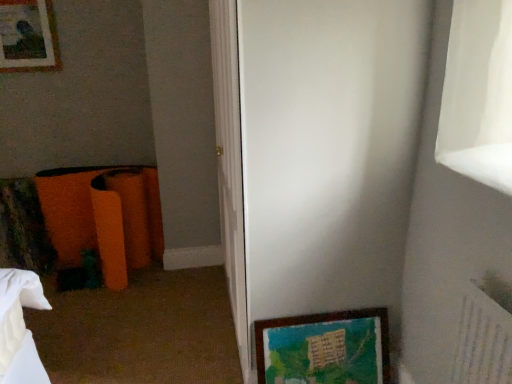
How much space does wooden framed artwork at lower right, which appears as the second picture frame when viewed from the left, occupy vertically?

The height of wooden framed artwork at lower right, which appears as the second picture frame when viewed from the left, is 36.14 centimeters.

Describe the element at coordinates (28, 36) in the screenshot. Image resolution: width=512 pixels, height=384 pixels. I see `matte wooden picture frame at upper left, the first picture frame viewed from the back` at that location.

What do you see at coordinates (328, 151) in the screenshot?
I see `white glossy screen door at center` at bounding box center [328, 151].

Find the location of a particular element. This screenshot has width=512, height=384. wooden framed artwork at lower right, which appears as the 2th picture frame when viewed from the top is located at coordinates (325, 348).

Which picture frame is the 1st one when counting from the back of the white glossy screen door at center? Please provide its 2D coordinates.

[(325, 348)]

Is white glossy screen door at center at the back of wooden framed artwork at lower right, the 1th picture frame in the right-to-left sequence?

Yes, wooden framed artwork at lower right, the 1th picture frame in the right-to-left sequence, is facing away from white glossy screen door at center.

From the image's perspective, is wooden framed artwork at lower right, positioned as the first picture frame in front-to-back order, located above or below white glossy screen door at center?

Answer: Based on their image positions, wooden framed artwork at lower right, positioned as the first picture frame in front-to-back order, is located beneath white glossy screen door at center.

Measure the distance from wooden framed artwork at lower right, which appears as the 2th picture frame when viewed from the top, to white glossy screen door at center.

16.13 inches.

Is wooden framed artwork at lower right, which appears as the 2th picture frame when viewed from the top, a part of matte wooden picture frame at upper left, acting as the 2th picture frame starting from the bottom?

That's incorrect, wooden framed artwork at lower right, which appears as the 2th picture frame when viewed from the top, is not inside matte wooden picture frame at upper left, acting as the 2th picture frame starting from the bottom.

From a real-world perspective, is matte wooden picture frame at upper left, which appears as the 1th picture frame when viewed from the top, beneath wooden framed artwork at lower right, which appears as the first picture frame when ordered from the bottom?

Incorrect, from a real-world perspective, matte wooden picture frame at upper left, which appears as the 1th picture frame when viewed from the top, is higher than wooden framed artwork at lower right, which appears as the first picture frame when ordered from the bottom.

Where is `picture frame that appears on the right of matte wooden picture frame at upper left, the second picture frame when ordered from right to left`? The image size is (512, 384). picture frame that appears on the right of matte wooden picture frame at upper left, the second picture frame when ordered from right to left is located at coordinates (325, 348).

Does white glossy screen door at center have a greater height compared to wooden framed artwork at lower right, the 2th picture frame positioned from the back?

Yes, white glossy screen door at center is taller than wooden framed artwork at lower right, the 2th picture frame positioned from the back.

From the picture: Considering the sizes of white glossy screen door at center and wooden framed artwork at lower right, positioned as the first picture frame in front-to-back order, in the image, is white glossy screen door at center wider or thinner than wooden framed artwork at lower right, positioned as the first picture frame in front-to-back order,?

In the image, white glossy screen door at center appears to be wider than wooden framed artwork at lower right, positioned as the first picture frame in front-to-back order.

Considering the positions of objects white glossy screen door at center and wooden framed artwork at lower right, positioned as the first picture frame in front-to-back order, in the image provided, who is in front, white glossy screen door at center or wooden framed artwork at lower right, positioned as the first picture frame in front-to-back order,?

white glossy screen door at center is more forward.

Is white glossy screen door at center to the right of matte wooden picture frame at upper left, the first picture frame viewed from the back, from the viewer's perspective?

Yes.

From a real-world perspective, between white glossy screen door at center and matte wooden picture frame at upper left, acting as the 2th picture frame starting from the bottom, who is vertically higher?

From a 3D spatial view, matte wooden picture frame at upper left, acting as the 2th picture frame starting from the bottom, is above.

Can you tell me how much white glossy screen door at center and matte wooden picture frame at upper left, which appears as the 1th picture frame when viewed from the top, differ in facing direction?

white glossy screen door at center and matte wooden picture frame at upper left, which appears as the 1th picture frame when viewed from the top, are facing 90.1 degrees away from each other.

In terms of size, does white glossy screen door at center appear bigger or smaller than matte wooden picture frame at upper left, which ranks as the first picture frame in left-to-right order?

Considering their sizes, white glossy screen door at center takes up more space than matte wooden picture frame at upper left, which ranks as the first picture frame in left-to-right order.

Considering the sizes of wooden framed artwork at lower right, the 1th picture frame in the right-to-left sequence, and matte wooden picture frame at upper left, which appears as the 1th picture frame when viewed from the top, in the image, is wooden framed artwork at lower right, the 1th picture frame in the right-to-left sequence, taller or shorter than matte wooden picture frame at upper left, which appears as the 1th picture frame when viewed from the top,?

Considering their sizes, wooden framed artwork at lower right, the 1th picture frame in the right-to-left sequence, has less height than matte wooden picture frame at upper left, which appears as the 1th picture frame when viewed from the top.

Is wooden framed artwork at lower right, the 2th picture frame positioned from the back, wider than matte wooden picture frame at upper left, which appears as the 1th picture frame when viewed from the top?

Indeed, wooden framed artwork at lower right, the 2th picture frame positioned from the back, has a greater width compared to matte wooden picture frame at upper left, which appears as the 1th picture frame when viewed from the top.

Are wooden framed artwork at lower right, the 2th picture frame positioned from the back, and matte wooden picture frame at upper left, the second picture frame positioned from the front, far apart?

Yes, wooden framed artwork at lower right, the 2th picture frame positioned from the back, is far from matte wooden picture frame at upper left, the second picture frame positioned from the front.

Is point (386, 351) closer or farther from the camera than point (39, 8)?

Point (386, 351) is closer to the camera than point (39, 8).

Measure the distance between matte wooden picture frame at upper left, acting as the 2th picture frame starting from the bottom, and white glossy screen door at center.

They are 6.51 feet apart.

Is white glossy screen door at center at the back of matte wooden picture frame at upper left, the first picture frame viewed from the back?

No, matte wooden picture frame at upper left, the first picture frame viewed from the back, is not facing the opposite direction of white glossy screen door at center.

Considering their positions, is matte wooden picture frame at upper left, which appears as the 1th picture frame when viewed from the top, located in front of or behind white glossy screen door at center?

Clearly, matte wooden picture frame at upper left, which appears as the 1th picture frame when viewed from the top, is behind white glossy screen door at center.

From the image's perspective, relative to white glossy screen door at center, is matte wooden picture frame at upper left, the second picture frame positioned from the front, above or below?

matte wooden picture frame at upper left, the second picture frame positioned from the front, is above white glossy screen door at center.

Find the location of a particular element. The height and width of the screenshot is (384, 512). screen door that is in front of the wooden framed artwork at lower right, the 2th picture frame positioned from the back is located at coordinates (328, 151).

This screenshot has height=384, width=512. In order to click on picture frame positioned vertically above the wooden framed artwork at lower right, which appears as the first picture frame when ordered from the bottom (from a real-world perspective) in this screenshot , I will do `click(28, 36)`.

From the image, which object appears to be nearer to matte wooden picture frame at upper left, which ranks as the first picture frame in left-to-right order, white glossy screen door at center or wooden framed artwork at lower right, the 2th picture frame positioned from the back?

white glossy screen door at center is positioned closer to the anchor matte wooden picture frame at upper left, which ranks as the first picture frame in left-to-right order.

Based on the photo, when comparing their distances from matte wooden picture frame at upper left, the second picture frame positioned from the front, does wooden framed artwork at lower right, which appears as the 2th picture frame when viewed from the top, or white glossy screen door at center seem further?

wooden framed artwork at lower right, which appears as the 2th picture frame when viewed from the top, is further to matte wooden picture frame at upper left, the second picture frame positioned from the front.

Based on their spatial positions, is matte wooden picture frame at upper left, the first picture frame viewed from the back, or white glossy screen door at center closer to wooden framed artwork at lower right, which appears as the second picture frame when viewed from the left?

The object closer to wooden framed artwork at lower right, which appears as the second picture frame when viewed from the left, is white glossy screen door at center.

Considering their positions, is matte wooden picture frame at upper left, acting as the 2th picture frame starting from the bottom, positioned closer to white glossy screen door at center than wooden framed artwork at lower right, positioned as the first picture frame in front-to-back order?

wooden framed artwork at lower right, positioned as the first picture frame in front-to-back order.

Estimate the real-world distances between objects in this image. Which object is further from white glossy screen door at center, wooden framed artwork at lower right, the 2th picture frame positioned from the back, or matte wooden picture frame at upper left, the second picture frame positioned from the front?

matte wooden picture frame at upper left, the second picture frame positioned from the front, is positioned further to the anchor white glossy screen door at center.

Considering their positions, is white glossy screen door at center positioned closer to wooden framed artwork at lower right, which appears as the first picture frame when ordered from the bottom, than matte wooden picture frame at upper left, the second picture frame positioned from the front?

white glossy screen door at center is positioned closer to the anchor wooden framed artwork at lower right, which appears as the first picture frame when ordered from the bottom.

You are a GUI agent. You are given a task and a screenshot of the screen. Output one action in this format:
    pyautogui.click(x=<x>, y=<y>)
    Task: Click on the screen door located between matte wooden picture frame at upper left, the second picture frame when ordered from right to left, and wooden framed artwork at lower right, which appears as the 2th picture frame when viewed from the top, in the left-right direction
    
    Given the screenshot: What is the action you would take?
    click(x=328, y=151)